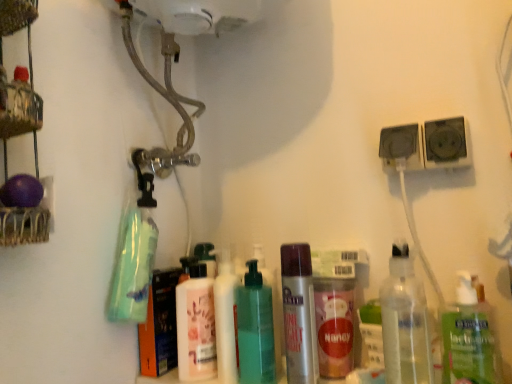
Question: From the image's perspective, is clear plastic bottle at lower right, positioned as the first bottle in right-to-left order, on green matte bottle at left, arranged as the 1th cleaning product when viewed from the left?

Choices:
 (A) yes
 (B) no

Answer: (B)

Question: Is the surface of clear plastic bottle at lower right, which is the 5th bottle from left to right, in direct contact with green matte bottle at left, which ranks as the 2th cleaning product in right-to-left order?

Choices:
 (A) no
 (B) yes

Answer: (A)

Question: Is clear plastic bottle at lower right, which is the 5th bottle from left to right, completely or partially outside of green matte bottle at left, arranged as the 1th cleaning product when viewed from the left?

Choices:
 (A) no
 (B) yes

Answer: (B)

Question: Can you confirm if clear plastic bottle at lower right, which is the 5th bottle from left to right, is positioned to the right of green matte bottle at left, arranged as the 1th cleaning product when viewed from the left?

Choices:
 (A) yes
 (B) no

Answer: (A)

Question: Can you confirm if clear plastic bottle at lower right, positioned as the first bottle in right-to-left order, is shorter than green matte bottle at left, which ranks as the 2th cleaning product in right-to-left order?

Choices:
 (A) yes
 (B) no

Answer: (A)

Question: Is pink matte lotion at center, acting as the 5th bottle starting from the right, to the left or to the right of green translucent bottle at center, which is the fourth bottle in right-to-left order, in the image?

Choices:
 (A) left
 (B) right

Answer: (A)

Question: Considering the positions of point (203, 306) and point (250, 331), is point (203, 306) closer or farther from the camera than point (250, 331)?

Choices:
 (A) farther
 (B) closer

Answer: (A)

Question: Considering the positions of pink matte lotion at center, acting as the 5th bottle starting from the right, and green translucent bottle at center, which is the fourth bottle in right-to-left order, in the image, is pink matte lotion at center, acting as the 5th bottle starting from the right, bigger or smaller than green translucent bottle at center, which is the fourth bottle in right-to-left order,?

Choices:
 (A) small
 (B) big

Answer: (A)

Question: From a real-world perspective, is pink matte lotion at center, which is the first bottle from left to right, physically located above or below green translucent bottle at center, which appears as the second bottle when viewed from the left?

Choices:
 (A) below
 (B) above

Answer: (A)

Question: In the image, is pink matte lotion at center, which is the first bottle from left to right, on the left side or the right side of black plastic socket at upper right, the first speaker from the left?

Choices:
 (A) left
 (B) right

Answer: (A)

Question: Relative to black plastic socket at upper right, the second speaker positioned from the right, is pink matte lotion at center, which is the first bottle from left to right, in front or behind?

Choices:
 (A) front
 (B) behind

Answer: (B)

Question: Considering the positions of point (187, 372) and point (401, 135), is point (187, 372) closer or farther from the camera than point (401, 135)?

Choices:
 (A) closer
 (B) farther

Answer: (B)

Question: Considering the positions of pink matte lotion at center, acting as the 5th bottle starting from the right, and black plastic socket at upper right, the second speaker positioned from the right, in the image, is pink matte lotion at center, acting as the 5th bottle starting from the right, taller or shorter than black plastic socket at upper right, the second speaker positioned from the right,?

Choices:
 (A) short
 (B) tall

Answer: (B)

Question: From a real-world perspective, is green translucent bottle at center, which appears as the second bottle when viewed from the left, physically located above or below clear plastic bottle at lower right, which is the 5th bottle from left to right?

Choices:
 (A) above
 (B) below

Answer: (A)

Question: In terms of size, does green translucent bottle at center, which is the fourth bottle in right-to-left order, appear bigger or smaller than clear plastic bottle at lower right, which is the 5th bottle from left to right?

Choices:
 (A) big
 (B) small

Answer: (A)